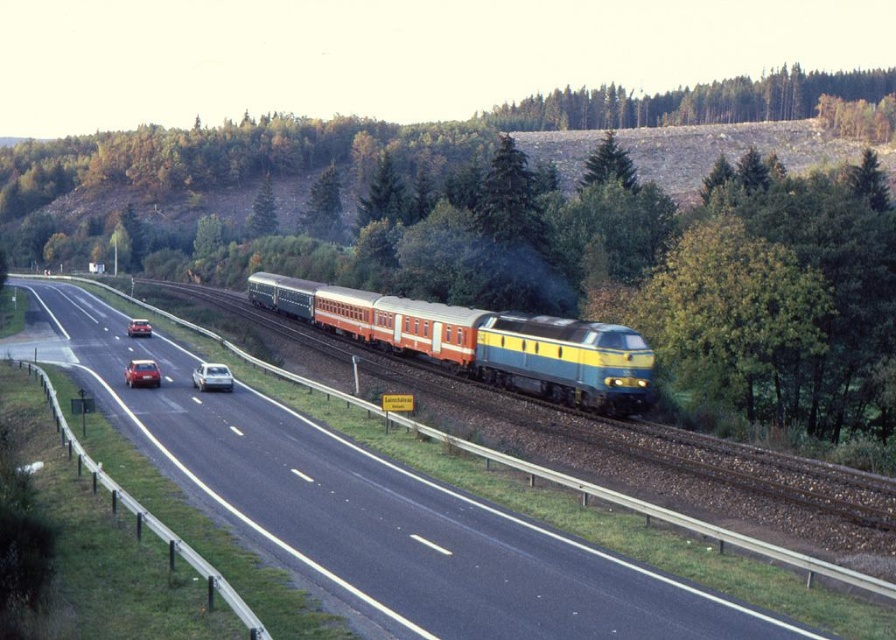
You are standing at the point labeled point (635, 380) and want to walk to the point labeled point (134, 332). Which direction should you move to get closer to your destination?

You should move downward because point (134, 332) is further away from the camera compared to point (635, 380), so moving downward will take you towards the destination.

You are a drone operator who needs to capture aerial footage of the black asphalt highway at center and the shiny red sedan at left. Based on their relative sizes in the image, which object should you focus on first to ensure both are in frame?

The black asphalt highway at center is taller than the shiny red sedan at left, so you should focus on the black asphalt highway at center first to ensure both are in frame.